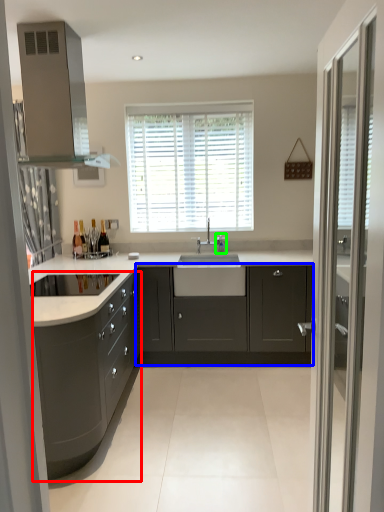
Question: Estimate the real-world distances between objects in this image. Which object is closer to cabinetry (highlighted by a red box), cabinetry (highlighted by a blue box) or faucet (highlighted by a green box)?

Choices:
 (A) cabinetry
 (B) faucet

Answer: (A)